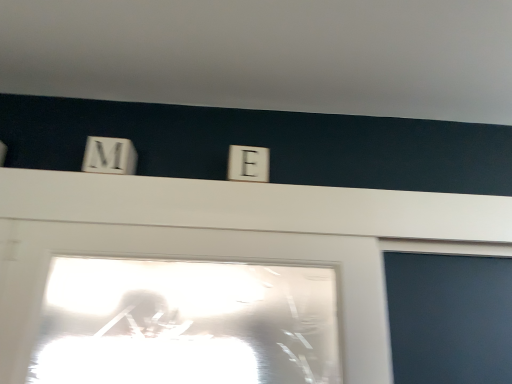
Question: Considering the relative sizes of white plastic letter e at center and white wooden letter m at upper left in the image provided, is white plastic letter e at center taller than white wooden letter m at upper left?

Choices:
 (A) yes
 (B) no

Answer: (B)

Question: Does white plastic letter e at center have a smaller size compared to white wooden letter m at upper left?

Choices:
 (A) yes
 (B) no

Answer: (B)

Question: Is white plastic letter e at center oriented away from white wooden letter m at upper left?

Choices:
 (A) yes
 (B) no

Answer: (B)

Question: Is white plastic letter e at center completely or partially outside of white wooden letter m at upper left?

Choices:
 (A) no
 (B) yes

Answer: (B)

Question: Is white wooden letter m at upper left located within white plastic letter e at center?

Choices:
 (A) no
 (B) yes

Answer: (A)

Question: Could you tell me if white plastic letter e at center is turned towards white wooden letter m at upper left?

Choices:
 (A) no
 (B) yes

Answer: (A)

Question: Is white wooden letter m at upper left touching white plastic letter e at center?

Choices:
 (A) yes
 (B) no

Answer: (B)

Question: Can you confirm if white wooden letter m at upper left is bigger than white plastic letter e at center?

Choices:
 (A) yes
 (B) no

Answer: (B)

Question: Is white wooden letter m at upper left further to camera compared to white plastic letter e at center?

Choices:
 (A) no
 (B) yes

Answer: (A)

Question: From a real-world perspective, does white wooden letter m at upper left sit lower than white plastic letter e at center?

Choices:
 (A) no
 (B) yes

Answer: (A)

Question: Is white wooden letter m at upper left oriented away from white plastic letter e at center?

Choices:
 (A) no
 (B) yes

Answer: (A)

Question: Is white wooden letter m at upper left thinner than white plastic letter e at center?

Choices:
 (A) no
 (B) yes

Answer: (B)

Question: In the image, is white plastic letter e at center positioned in front of or behind white wooden letter m at upper left?

Choices:
 (A) behind
 (B) front

Answer: (A)